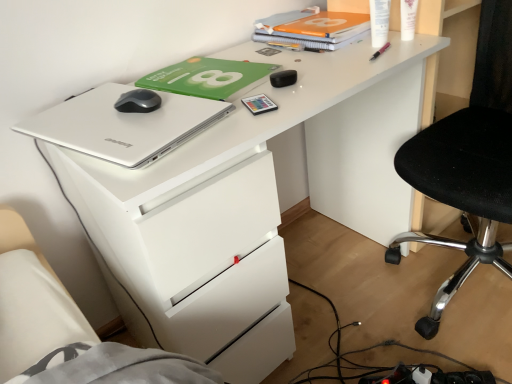
Locate an element on the screen. Image resolution: width=512 pixels, height=384 pixels. free location in front of green matte paperback book at upper center is located at coordinates (259, 112).